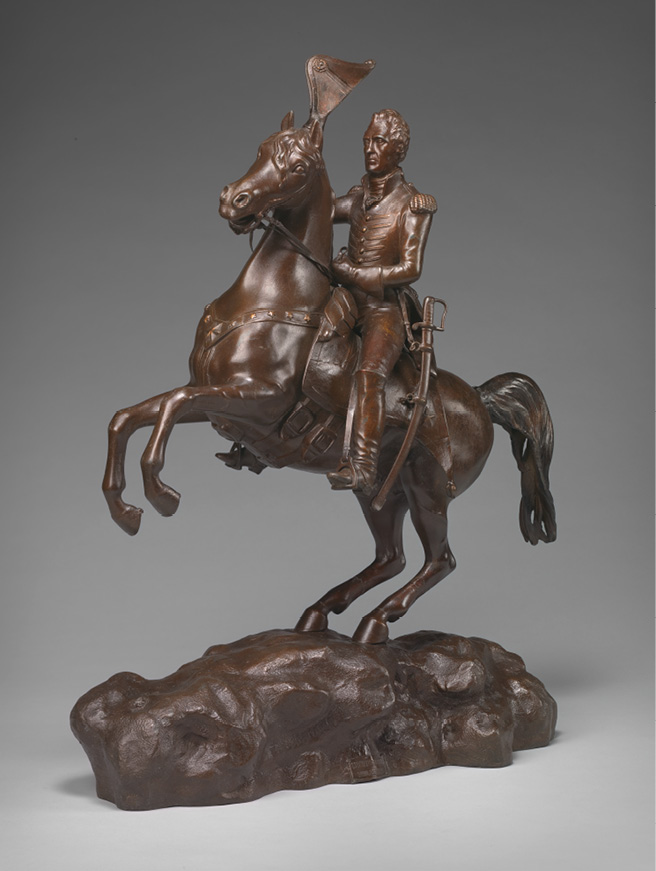
At what (x,y) coordinates should I click in order to perform the action: click on statue/figurine. Please return your answer as a coordinate pair (x, y). This screenshot has height=871, width=656. Looking at the image, I should click on (365, 365).